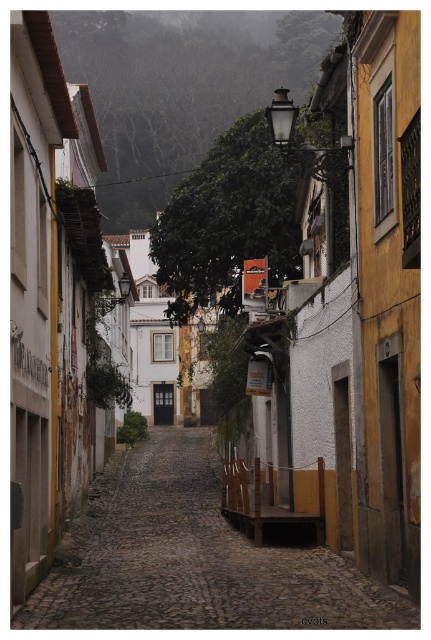
Does yellow textured wall at right have a lesser width compared to green leafy hillside at upper center?

Indeed, yellow textured wall at right has a lesser width compared to green leafy hillside at upper center.

Can you confirm if yellow textured wall at right is shorter than green leafy hillside at upper center?

Indeed, yellow textured wall at right has a lesser height compared to green leafy hillside at upper center.

Who is more distant from viewer, (402, 301) or (131, 138)?

The point (131, 138) is more distant.

You are a GUI agent. You are given a task and a screenshot of the screen. Output one action in this format:
    pyautogui.click(x=<x>, y=<y>)
    Task: Click on the yellow textured wall at right
    The width and height of the screenshot is (431, 640).
    Given the screenshot: What is the action you would take?
    pyautogui.click(x=386, y=288)

Is point (62, 556) positioned after point (375, 548)?

Yes, point (62, 556) is farther from viewer.

Locate an element on the screen. smooth stone path at center is located at coordinates (193, 557).

I want to click on smooth stone path at center, so click(x=193, y=557).

Between smooth stone path at center and green leafy hillside at upper center, which one has more height?

green leafy hillside at upper center

Does point (181, 548) come farther from viewer compared to point (174, 12)?

No, it is in front of (174, 12).

The image size is (431, 640). I want to click on smooth stone path at center, so click(x=193, y=557).